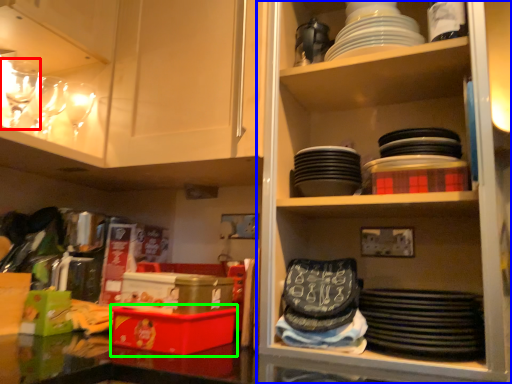
Question: Which is nearer to the tableware (highlighted by a red box)? shelf (highlighted by a blue box) or box (highlighted by a green box).

Choices:
 (A) shelf
 (B) box

Answer: (B)